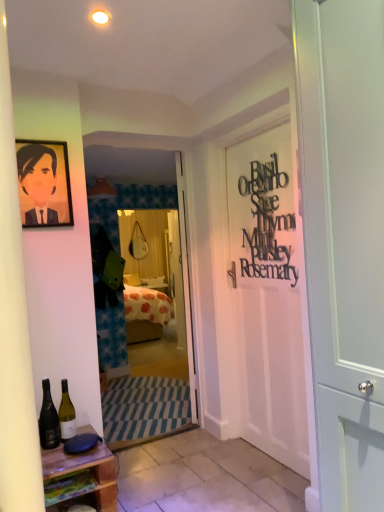
Locate an element on the screen. Image resolution: width=384 pixels, height=512 pixels. empty space that is in between white wooden door at center, which appears as the 1th door when viewed from the left, and clear plastic screen door at center is located at coordinates (164, 422).